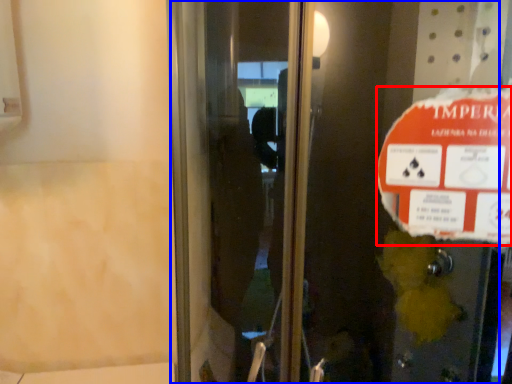
Question: Which point is further to the camera, street sign (highlighted by a red box) or elevator door (highlighted by a blue box)?

Choices:
 (A) street sign
 (B) elevator door

Answer: (A)